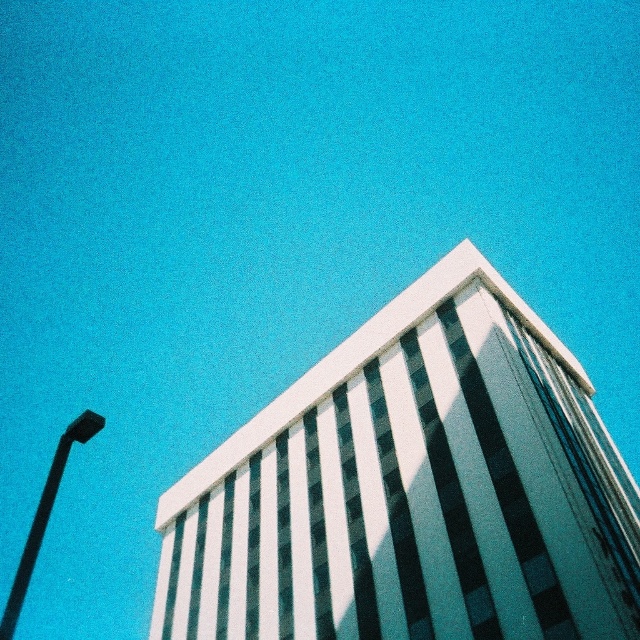
Is white glass building at center positioned in front of black plastic lamp post at left?

No, white glass building at center is behind black plastic lamp post at left.

Based on the photo, who is more distant from viewer, (332, 513) or (84, 436)?

The point (332, 513) is behind.

Identify the location of white glass building at center. The width and height of the screenshot is (640, 640). (412, 488).